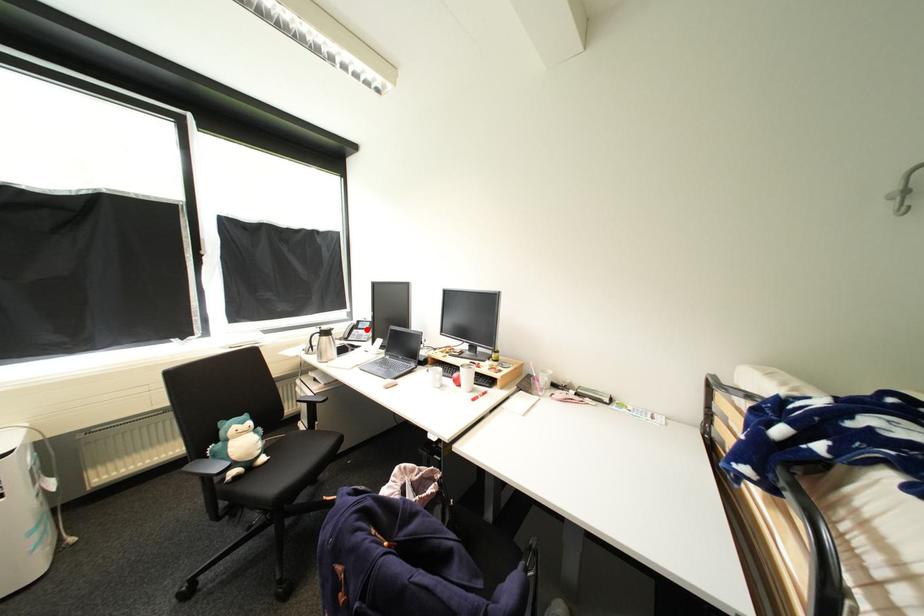
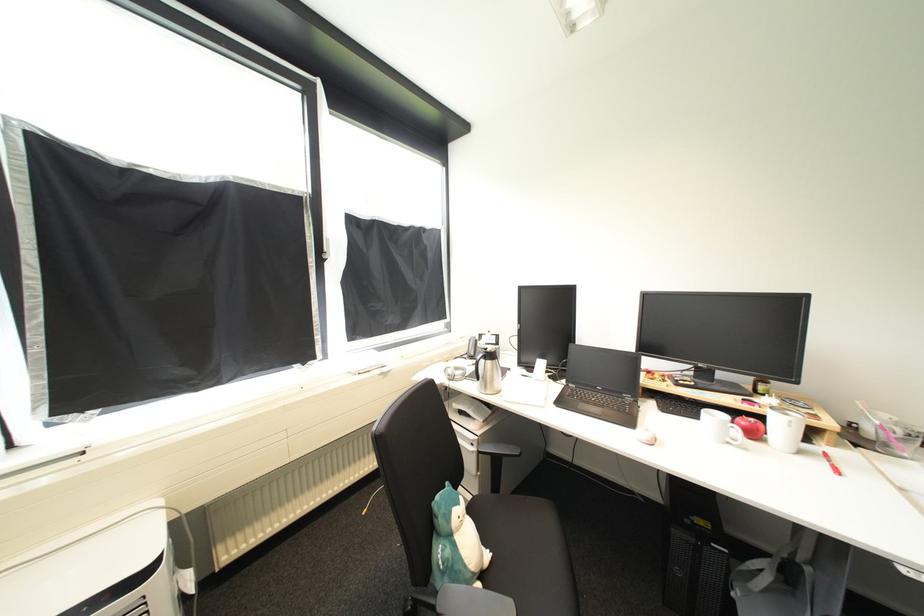
The point at the highlighted location is marked in the first image. Where is the corresponding point in the second image?

(492, 345)